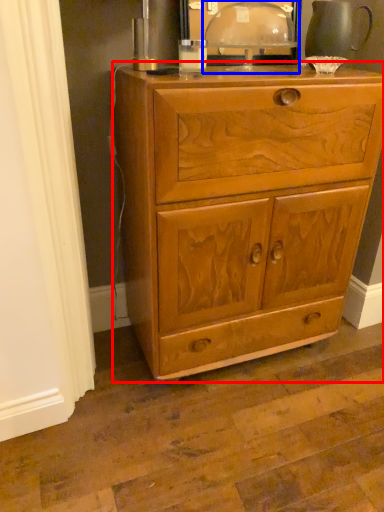
Question: Which object appears closest to the camera in this image, chest of drawers (highlighted by a red box) or table lamp (highlighted by a blue box)?

Choices:
 (A) chest of drawers
 (B) table lamp

Answer: (A)